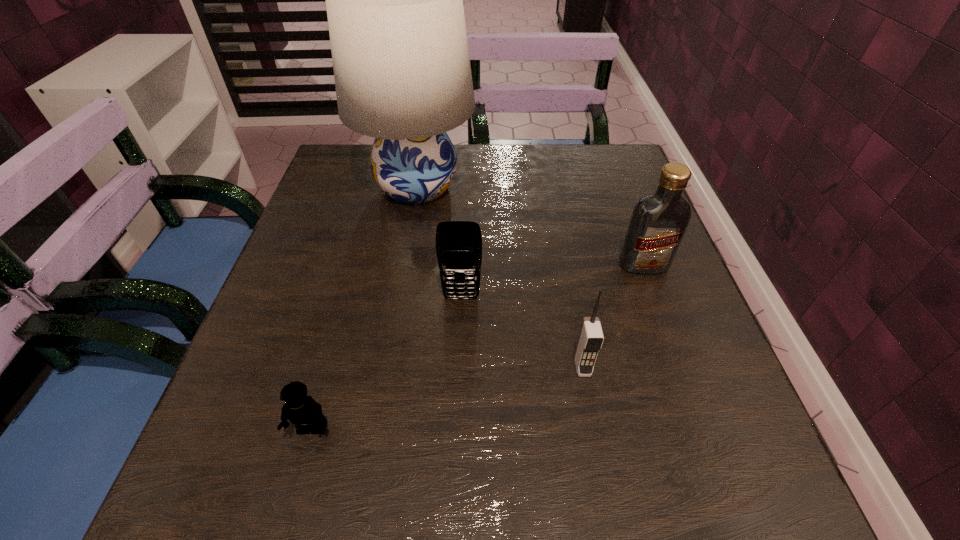
This screenshot has height=540, width=960. I want to click on vacant position at the far edge of the desktop, so click(x=507, y=192).

Where is `free point at the near edge`? free point at the near edge is located at coordinates (492, 473).

Locate an element on the screen. Image resolution: width=960 pixels, height=540 pixels. vacant space at the left edge of the desktop is located at coordinates (354, 198).

Find the location of `vacant space at the right edge of the desktop`. vacant space at the right edge of the desktop is located at coordinates (605, 222).

Locate an element on the screen. free region at the far left corner of the desktop is located at coordinates (364, 146).

This screenshot has height=540, width=960. In the image, there is a desktop. In order to click on vacant area at the far right corner in this screenshot , I will do `click(589, 163)`.

The height and width of the screenshot is (540, 960). In order to click on free space at the near right corner of the desktop in this screenshot , I will do `click(699, 523)`.

Locate an element on the screen. empty location between the shortest object and the lampshade is located at coordinates (365, 308).

Locate an element on the screen. This screenshot has height=540, width=960. empty location between the third farthest object and the second nearest object is located at coordinates (522, 332).

Find the location of a particular element. The width and height of the screenshot is (960, 540). free space between the second farthest object and the nearer cellular telephone is located at coordinates (612, 315).